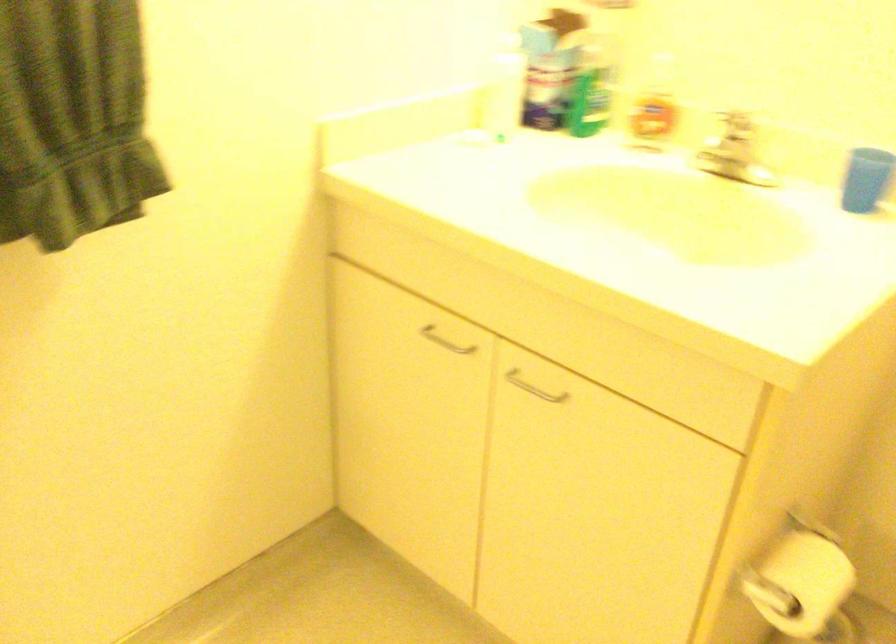
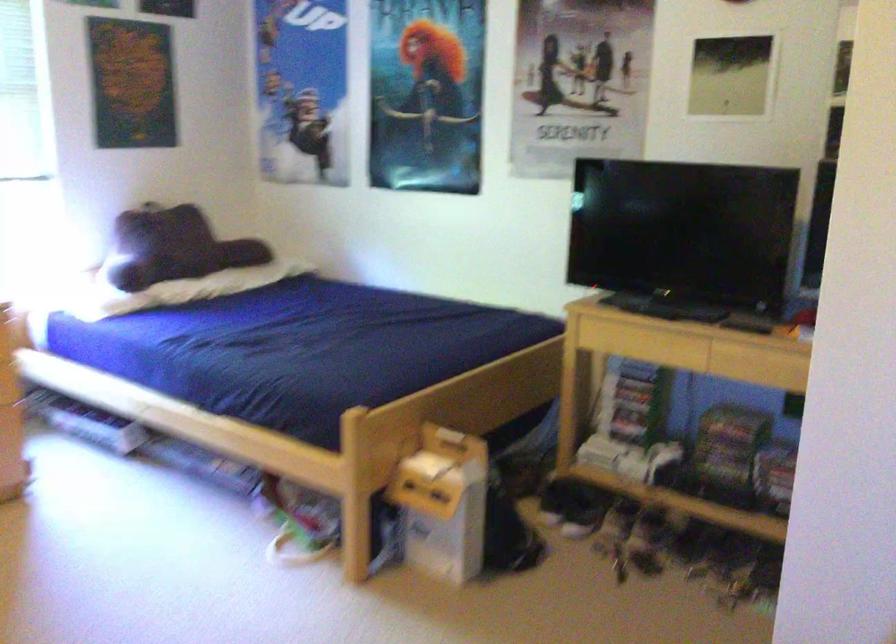
Question: The images are taken continuously from a first-person perspective. In which direction are you moving?

Choices:
 (A) Left
 (B) Right
 (C) Forward
 (D) Backward

Answer: (A)